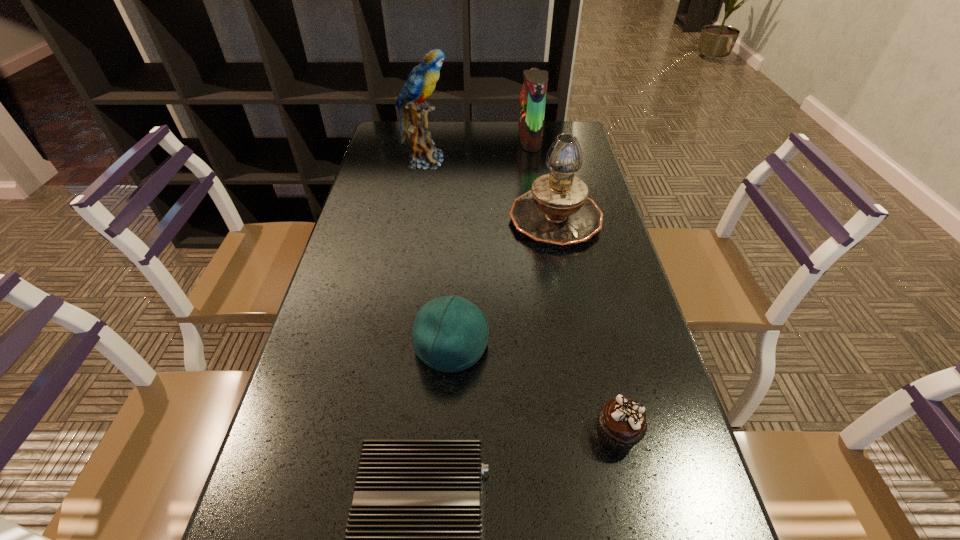
The width and height of the screenshot is (960, 540). I want to click on vacant space at the far edge of the desktop, so click(x=502, y=123).

In the image, there is a desktop. In order to click on vacant space at the left edge in this screenshot , I will do 315,387.

You are a GUI agent. You are given a task and a screenshot of the screen. Output one action in this format:
    pyautogui.click(x=<x>, y=<y>)
    Task: Click on the vacant space at the right edge of the desktop
    This screenshot has width=960, height=540.
    Given the screenshot: What is the action you would take?
    pyautogui.click(x=578, y=247)

Identify the location of free spot at the far left corner of the desktop. (394, 128).

Find the location of `free space at the far right corner of the desktop`. free space at the far right corner of the desktop is located at coordinates (578, 132).

Locate an element on the screen. This screenshot has width=960, height=540. vacant area that lies between the beanie and the right parrot is located at coordinates (491, 243).

Find the location of a particular element. vacant space in between the cupcake and the right parrot is located at coordinates (573, 287).

I want to click on free area in between the third farthest object and the third nearest object, so click(x=503, y=281).

What are the coordinates of `vacant point located between the oil lamp and the tallest object` in the screenshot? It's located at (490, 189).

Select which object is the fifth closest to the right parrot. Please provide its 2D coordinates. Your answer should be formatted as a tuple, i.e. [(x, y)], where the tuple contains the x and y coordinates of a point satisfying the conditions above.

[(413, 539)]